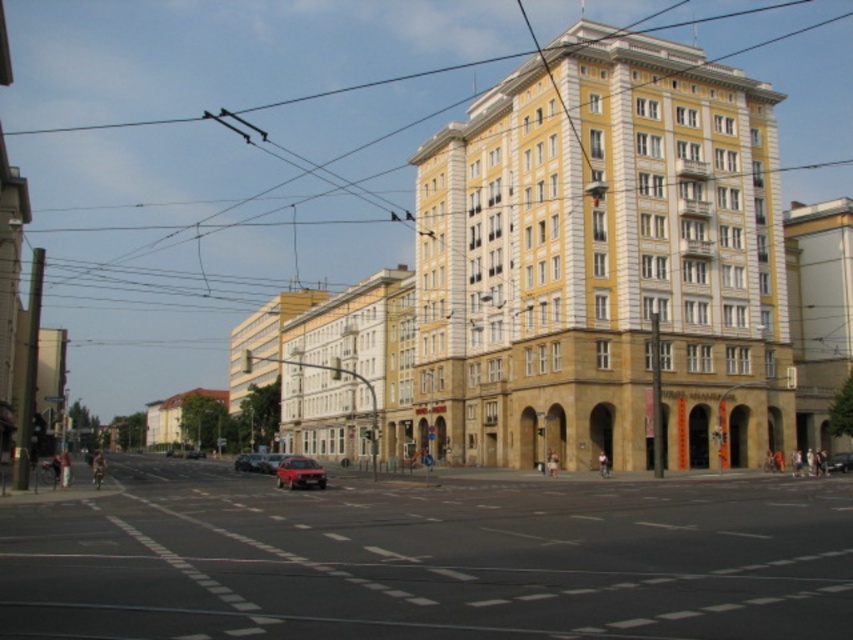
Which is below, metallic silver car at center or red matte car at center?

Positioned lower is red matte car at center.

Can you confirm if metallic silver car at center is bigger than red matte car at center?

No.

Identify the location of metallic silver car at center. (299, 474).

Can you confirm if metallic silver car at center is positioned to the right of shiny red car at center?

In fact, metallic silver car at center is to the left of shiny red car at center.

Is point (282, 474) positioned before point (825, 465)?

Yes, it is in front of point (825, 465).

Identify the location of metallic silver car at center. The height and width of the screenshot is (640, 853). (299, 474).

Can you confirm if smooth asphalt road at center is wider than shiny red car at center?

Indeed, smooth asphalt road at center has a greater width compared to shiny red car at center.

Is smooth asphalt road at center in front of shiny red car at center?

Yes, it is in front of shiny red car at center.

Measure the distance between smooth asphalt road at center and camera.

smooth asphalt road at center is 102.86 feet from camera.

Where is `smooth asphalt road at center`? smooth asphalt road at center is located at coordinates (428, 561).